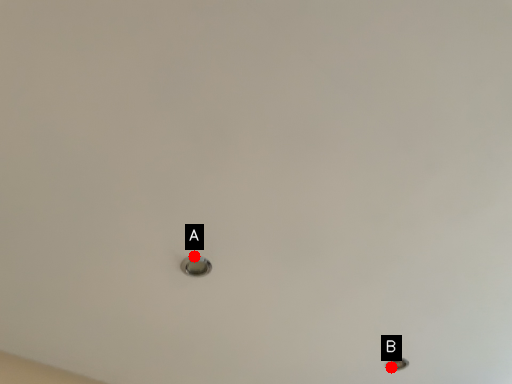
Question: Two points are circled on the image, labeled by A and B beside each circle. Which point appears closest to the camera in this image?

Choices:
 (A) A is closer
 (B) B is closer

Answer: (A)